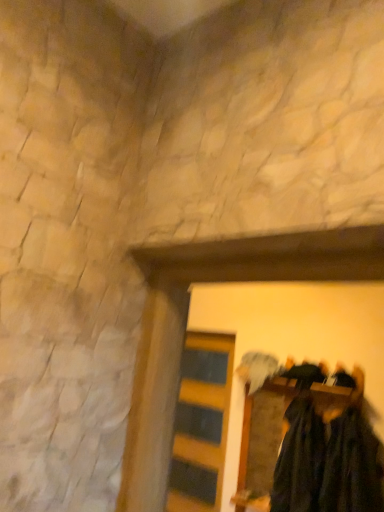
Question: Is dark green fabric at lower right, the first clothing in the left-to-right sequence, situated inside dark green fuzzy sweater at lower right, arranged as the 1th clothing when viewed from the right, or outside?

Choices:
 (A) outside
 (B) inside

Answer: (A)

Question: From the image's perspective, is dark green fabric at lower right, the second clothing when ordered from right to left, located above or below dark green fuzzy sweater at lower right, the 2th clothing positioned from the left?

Choices:
 (A) below
 (B) above

Answer: (A)

Question: Which object is positioned closest to the dark green fabric at lower right, the first clothing in the left-to-right sequence?

Choices:
 (A) dark green fabric at center
 (B) dark green fuzzy sweater at lower right, the 2th clothing positioned from the left
 (C) yellow striped wood at center

Answer: (A)

Question: Based on their relative distances, which object is nearer to the dark green fabric at lower right, the first clothing in the left-to-right sequence?

Choices:
 (A) dark green fabric at center
 (B) yellow striped wood at center
 (C) dark green fuzzy sweater at lower right, the 2th clothing positioned from the left

Answer: (A)